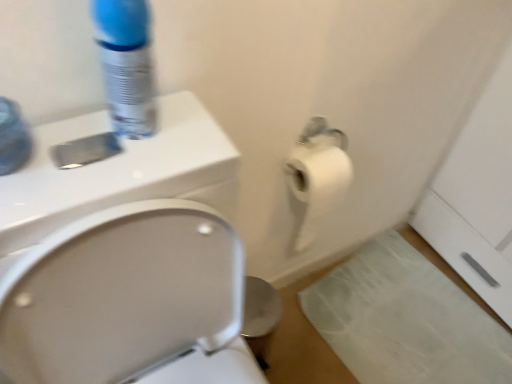
This screenshot has height=384, width=512. I want to click on vacant area that is in front of metallic silver spray can at upper left, so click(x=100, y=175).